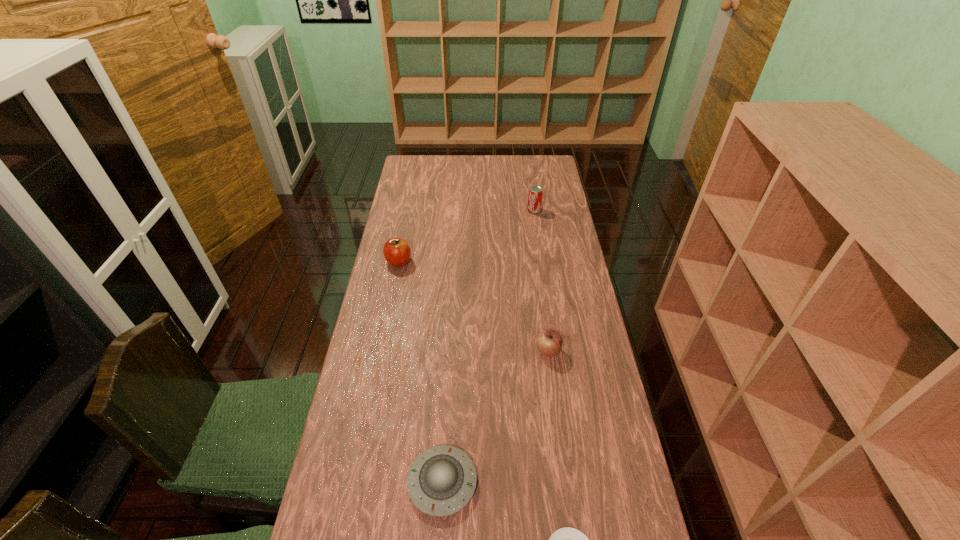
Where is `vacant region between the nearer apple and the farthest object`? The height and width of the screenshot is (540, 960). vacant region between the nearer apple and the farthest object is located at coordinates (541, 281).

The height and width of the screenshot is (540, 960). Find the location of `unoccupied position between the saucer and the soda can`. unoccupied position between the saucer and the soda can is located at coordinates (488, 346).

Identify the location of object that is the closest to the second shortest object. This screenshot has height=540, width=960. (567, 539).

At what (x,y) coordinates should I click in order to perform the action: click on object that is the fourth nearest to the saucer. Please return your answer as a coordinate pair (x, y). This screenshot has width=960, height=540. Looking at the image, I should click on (535, 194).

What are the coordinates of `vacant space that satisfies the following two spatial constraints: 1. on the back side of the second farthest object; 2. on the right side of the soda can` in the screenshot? It's located at (409, 211).

Identify the location of free space that satisfies the following two spatial constraints: 1. on the back side of the farthest object; 2. on the right side of the fourth tallest object. Image resolution: width=960 pixels, height=540 pixels. (459, 211).